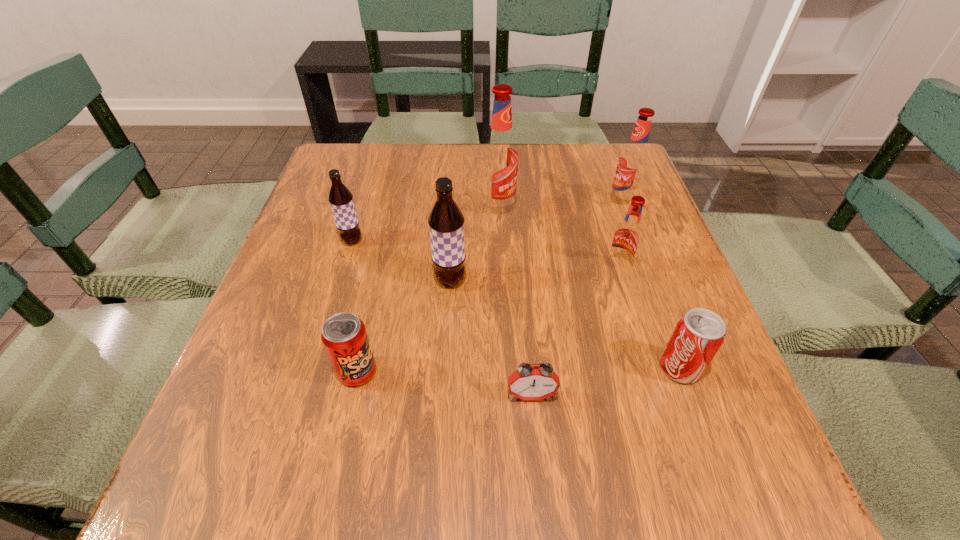
Where is `vacant space located 0.350m on the right of the left red soda can`? Image resolution: width=960 pixels, height=540 pixels. vacant space located 0.350m on the right of the left red soda can is located at coordinates (581, 372).

At what (x,y) coordinates should I click in order to perform the action: click on vacant area located 0.130m on the clock face of the shortest object. Please return your answer as a coordinate pair (x, y). This screenshot has width=960, height=540. Looking at the image, I should click on (540, 489).

This screenshot has width=960, height=540. What are the coordinates of `object present at the left edge` in the screenshot? It's located at (340, 198).

Locate an element on the screen. soda can that is at the right edge is located at coordinates (699, 333).

In the image, there is a desktop. Where is `free space at the far edge`? free space at the far edge is located at coordinates [x=463, y=172].

The width and height of the screenshot is (960, 540). I want to click on vacant area at the left edge, so click(x=302, y=285).

Where is `free region at the right edge of the desktop`? free region at the right edge of the desktop is located at coordinates (730, 414).

Where is `vacant region at the far right corner of the desktop`? vacant region at the far right corner of the desktop is located at coordinates (578, 145).

This screenshot has height=540, width=960. In order to click on vacant point located between the leftmost red root beer and the leftmost object in this screenshot , I will do `click(425, 225)`.

Identify the location of free space between the alarm clock and the right red soda can. (606, 382).